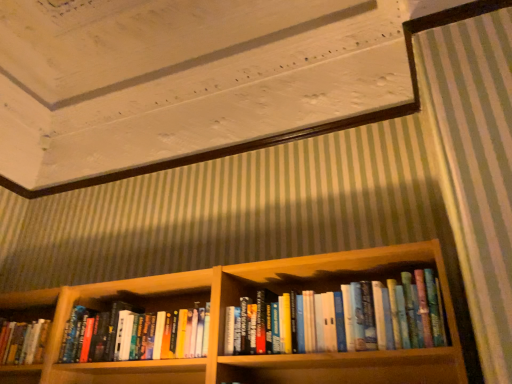
Question: Which is correct: hardcover books at center is inside wooden bookshelf at center, or outside of it?

Choices:
 (A) outside
 (B) inside

Answer: (A)

Question: Considering their positions, is hardcover books at center located in front of or behind wooden bookshelf at center?

Choices:
 (A) behind
 (B) front

Answer: (B)

Question: Considering the real-world distances, which object is closest to the wooden bookshelf at lower left?

Choices:
 (A) wooden bookshelf at center
 (B) hardcover books at center

Answer: (A)

Question: Based on their relative distances, which object is nearer to the wooden bookshelf at center?

Choices:
 (A) wooden bookshelf at lower left
 (B) hardcover books at center

Answer: (A)